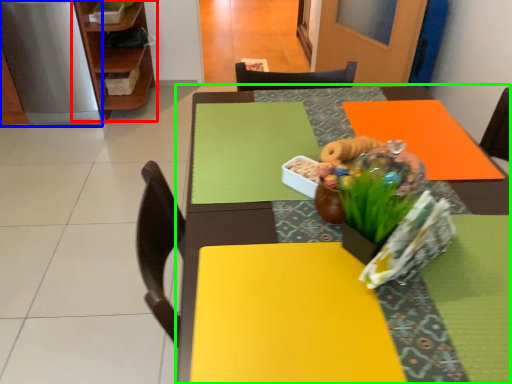
Question: Estimate the real-world distances between objects in this image. Which object is closer to shelf (highlighted by a red box), appliance (highlighted by a blue box) or table (highlighted by a green box)?

Choices:
 (A) appliance
 (B) table

Answer: (A)